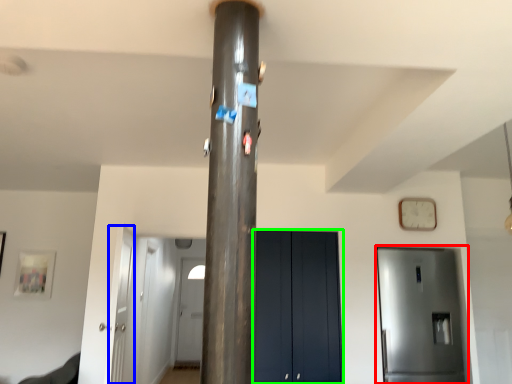
Question: Based on their relative distances, which object is nearer to door (highlighted by a red box)? Choose from door (highlighted by a blue box) and door (highlighted by a green box).

Choices:
 (A) door
 (B) door

Answer: (B)